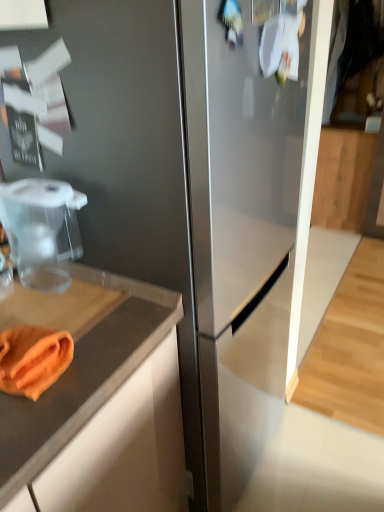
Question: In terms of height, does wooden cabinet at right look taller or shorter compared to orange cloth at lower left?

Choices:
 (A) tall
 (B) short

Answer: (A)

Question: Based on their positions, is wooden cabinet at right located to the left or right of orange cloth at lower left?

Choices:
 (A) left
 (B) right

Answer: (B)

Question: Considering the real-world distances, which object is farthest from the orange cloth at lower left?

Choices:
 (A) wooden cabinet at right
 (B) transparent plastic food processor at left

Answer: (A)

Question: Estimate the real-world distances between objects in this image. Which object is farther from the orange cloth at lower left?

Choices:
 (A) transparent plastic food processor at left
 (B) wooden cabinet at right

Answer: (B)